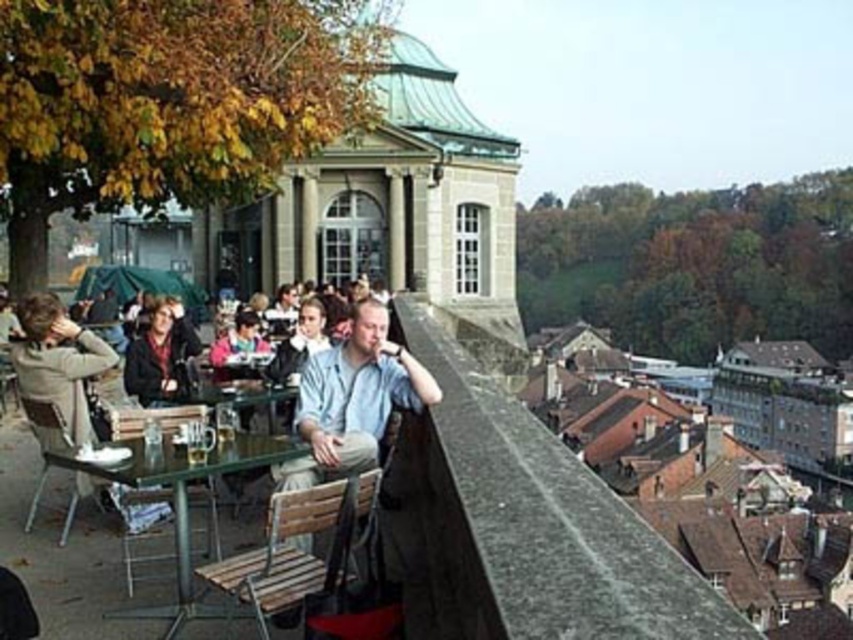
You are a photographer standing at the camera position. You want to capture a closeup shot of the green glass table at center. Considering the distance, do you think you can reach it without moving from your current position?

The green glass table at center is 37.23 meters away from camera. Since this distance is quite far, you would need a telephoto lens to capture a closeup shot without moving closer.